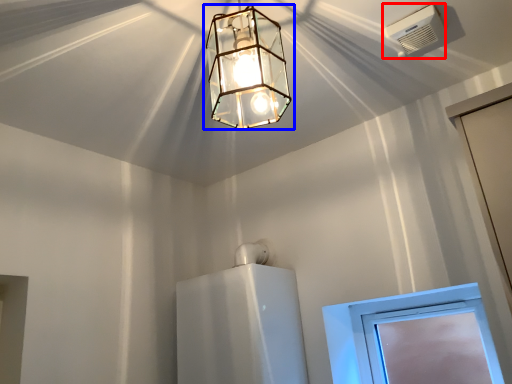
Question: Among these objects, which one is nearest to the camera, air conditioning (highlighted by a red box) or lamp (highlighted by a blue box)?

Choices:
 (A) air conditioning
 (B) lamp

Answer: (B)